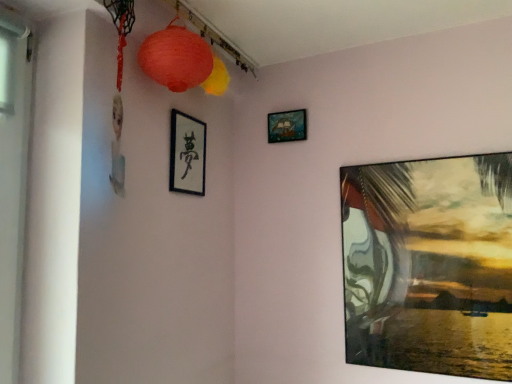
Where is `black matte picture frame at upper center, which ranks as the 2th picture frame in top-to-bottom order`? black matte picture frame at upper center, which ranks as the 2th picture frame in top-to-bottom order is located at coordinates coord(187,154).

What is the approximate width of matte paper lantern at upper center, positioned as the first lantern in front-to-back order?

matte paper lantern at upper center, positioned as the first lantern in front-to-back order, is 5.38 inches in width.

Measure the distance between point (222, 83) and camera.

Point (222, 83) is 5.52 feet from camera.

Where is `matte paper lantern at upper center, arranged as the 1th lantern when viewed from the back`? matte paper lantern at upper center, arranged as the 1th lantern when viewed from the back is located at coordinates (217, 78).

Where is `wooden ship at upper center, the 1th picture frame positioned from the top`? The image size is (512, 384). wooden ship at upper center, the 1th picture frame positioned from the top is located at coordinates (287, 126).

The image size is (512, 384). I want to click on lantern that appears in front of the matte glass painting at right, the first picture frame in the bottom-to-top sequence, so click(176, 58).

Does matte glass painting at right, which is the third picture frame in top-to-bottom order, have a smaller size compared to matte paper lantern at upper center, which is the 2th lantern in back-to-front order?

No.

Does point (462, 279) lie in front of point (153, 42)?

No.

From the image's perspective, which is below, matte glass painting at right, the first picture frame in the bottom-to-top sequence, or matte paper lantern at upper center, which is the 2th lantern in back-to-front order?

matte glass painting at right, the first picture frame in the bottom-to-top sequence, appears lower in the image.

Considering the positions of points (198, 45) and (283, 118), is point (198, 45) closer to camera compared to point (283, 118)?

Yes, point (198, 45) is closer to viewer.

How far apart are matte paper lantern at upper center, positioned as the first lantern in front-to-back order, and wooden ship at upper center, the 1th picture frame positioned from the top?

matte paper lantern at upper center, positioned as the first lantern in front-to-back order, and wooden ship at upper center, the 1th picture frame positioned from the top, are 25.85 inches apart from each other.

Who is smaller, matte paper lantern at upper center, positioned as the first lantern in front-to-back order, or wooden ship at upper center, acting as the 2th picture frame starting from the left?

wooden ship at upper center, acting as the 2th picture frame starting from the left.

Locate an element on the screen. Image resolution: width=512 pixels, height=384 pixels. the 1st picture frame positioned below the matte paper lantern at upper center, which is the 2th lantern in back-to-front order (from a real-world perspective) is located at coordinates (287, 126).

Which of these two, black matte picture frame at upper center, which appears as the 2th picture frame when ordered from the bottom, or matte paper lantern at upper center, positioned as the first lantern in front-to-back order, is smaller?

Smaller between the two is black matte picture frame at upper center, which appears as the 2th picture frame when ordered from the bottom.

Is point (184, 169) closer or farther from the camera than point (187, 51)?

Point (184, 169).

Between black matte picture frame at upper center, the first picture frame viewed from the left, and matte paper lantern at upper center, positioned as the first lantern in front-to-back order, which one has less height?

matte paper lantern at upper center, positioned as the first lantern in front-to-back order, is shorter.

In the scene shown: Is black matte picture frame at upper center, acting as the third picture frame starting from the right, aimed at matte paper lantern at upper center, positioned as the first lantern in front-to-back order?

No, black matte picture frame at upper center, acting as the third picture frame starting from the right, is not oriented towards matte paper lantern at upper center, positioned as the first lantern in front-to-back order.

In the image, is matte paper lantern at upper center, arranged as the 1th lantern when viewed from the back, positioned in front of or behind matte paper lantern at upper center, positioned as the first lantern in front-to-back order?

In the image, matte paper lantern at upper center, arranged as the 1th lantern when viewed from the back, appears behind matte paper lantern at upper center, positioned as the first lantern in front-to-back order.

Is matte paper lantern at upper center, the second lantern positioned from the front, directly adjacent to matte paper lantern at upper center, positioned as the first lantern in front-to-back order?

No.

Measure the distance from matte paper lantern at upper center, the second lantern positioned from the front, to matte paper lantern at upper center, which is the 2th lantern in back-to-front order.

The distance of matte paper lantern at upper center, the second lantern positioned from the front, from matte paper lantern at upper center, which is the 2th lantern in back-to-front order, is 6.45 inches.

Is matte paper lantern at upper center, arranged as the 1th lantern when viewed from the back, located outside matte paper lantern at upper center, which is the 2th lantern in back-to-front order?

matte paper lantern at upper center, arranged as the 1th lantern when viewed from the back, is positioned outside matte paper lantern at upper center, which is the 2th lantern in back-to-front order.

Is matte paper lantern at upper center, the second lantern positioned from the front, far from wooden ship at upper center, the second picture frame from the right?

No, matte paper lantern at upper center, the second lantern positioned from the front, is in close proximity to wooden ship at upper center, the second picture frame from the right.

Is point (228, 80) less distant than point (279, 112)?

No, (228, 80) is further to viewer.

Is matte paper lantern at upper center, the second lantern positioned from the front, turned away from wooden ship at upper center, acting as the 2th picture frame starting from the left?

matte paper lantern at upper center, the second lantern positioned from the front, is not turned away from wooden ship at upper center, acting as the 2th picture frame starting from the left.

Who is taller, matte paper lantern at upper center, arranged as the 1th lantern when viewed from the back, or wooden ship at upper center, acting as the 2th picture frame starting from the left?

matte paper lantern at upper center, arranged as the 1th lantern when viewed from the back, is taller.

From a real-world perspective, is matte glass painting at right, the first picture frame in the bottom-to-top sequence, physically located above or below wooden ship at upper center, the second picture frame from the right?

In terms of real-world spatial position, matte glass painting at right, the first picture frame in the bottom-to-top sequence, is below wooden ship at upper center, the second picture frame from the right.

Does matte glass painting at right, the first picture frame in the bottom-to-top sequence, touch wooden ship at upper center, acting as the 2th picture frame starting from the left?

No, matte glass painting at right, the first picture frame in the bottom-to-top sequence, is not with wooden ship at upper center, acting as the 2th picture frame starting from the left.

Relative to wooden ship at upper center, the 1th picture frame positioned from the top, is matte glass painting at right, which is the third picture frame in top-to-bottom order, in front or behind?

matte glass painting at right, which is the third picture frame in top-to-bottom order, is in front of wooden ship at upper center, the 1th picture frame positioned from the top.

From the image's perspective, which object appears higher, matte paper lantern at upper center, positioned as the first lantern in front-to-back order, or matte glass painting at right, the third picture frame in the left-to-right sequence?

matte paper lantern at upper center, positioned as the first lantern in front-to-back order, appears higher in the image.

In the image, is matte paper lantern at upper center, positioned as the first lantern in front-to-back order, positioned in front of or behind matte glass painting at right, which is the third picture frame in top-to-bottom order?

In the image, matte paper lantern at upper center, positioned as the first lantern in front-to-back order, appears in front of matte glass painting at right, which is the third picture frame in top-to-bottom order.

In terms of height, does matte paper lantern at upper center, positioned as the first lantern in front-to-back order, look taller or shorter compared to matte glass painting at right, the first picture frame in the bottom-to-top sequence?

In the image, matte paper lantern at upper center, positioned as the first lantern in front-to-back order, appears to be shorter than matte glass painting at right, the first picture frame in the bottom-to-top sequence.

The height and width of the screenshot is (384, 512). What are the coordinates of `lantern that is the 2nd one when counting leftward from the matte glass painting at right, arranged as the first picture frame when viewed from the right` in the screenshot? It's located at (176, 58).

Locate an element on the screen. The width and height of the screenshot is (512, 384). picture frame that is the 1st object directly below the matte paper lantern at upper center, which is the 2th lantern in back-to-front order (from a real-world perspective) is located at coordinates coord(287,126).

Based on their spatial positions, is matte glass painting at right, the first picture frame in the bottom-to-top sequence, or matte paper lantern at upper center, which is the 2th lantern in back-to-front order, further from black matte picture frame at upper center, which ranks as the 2th picture frame in top-to-bottom order?

Based on the image, matte glass painting at right, the first picture frame in the bottom-to-top sequence, appears to be further to black matte picture frame at upper center, which ranks as the 2th picture frame in top-to-bottom order.

Looking at the image, which one is located further to black matte picture frame at upper center, which appears as the 2th picture frame when ordered from the bottom, matte paper lantern at upper center, the second lantern positioned from the front, or matte paper lantern at upper center, positioned as the first lantern in front-to-back order?

matte paper lantern at upper center, positioned as the first lantern in front-to-back order, lies further to black matte picture frame at upper center, which appears as the 2th picture frame when ordered from the bottom, than the other object.

From the image, which object appears to be farther from black matte picture frame at upper center, which appears as the 2th picture frame when ordered from the bottom, wooden ship at upper center, the second picture frame from the right, or matte paper lantern at upper center, which is the 2th lantern in back-to-front order?

wooden ship at upper center, the second picture frame from the right, is further to black matte picture frame at upper center, which appears as the 2th picture frame when ordered from the bottom.

When comparing their distances from matte paper lantern at upper center, the second lantern positioned from the front, does matte glass painting at right, which is the third picture frame in top-to-bottom order, or matte paper lantern at upper center, which is the 2th lantern in back-to-front order, seem closer?

matte paper lantern at upper center, which is the 2th lantern in back-to-front order, is closer to matte paper lantern at upper center, the second lantern positioned from the front.

Based on their spatial positions, is matte paper lantern at upper center, positioned as the first lantern in front-to-back order, or black matte picture frame at upper center, the first picture frame viewed from the left, closer to matte paper lantern at upper center, arranged as the 1th lantern when viewed from the back?

The object closer to matte paper lantern at upper center, arranged as the 1th lantern when viewed from the back, is matte paper lantern at upper center, positioned as the first lantern in front-to-back order.

Estimate the real-world distances between objects in this image. Which object is closer to wooden ship at upper center, the 1th picture frame positioned from the top, matte paper lantern at upper center, the second lantern positioned from the front, or matte glass painting at right, arranged as the first picture frame when viewed from the right?

matte paper lantern at upper center, the second lantern positioned from the front.

Based on their spatial positions, is matte paper lantern at upper center, positioned as the first lantern in front-to-back order, or matte glass painting at right, arranged as the first picture frame when viewed from the right, further from matte paper lantern at upper center, the second lantern positioned from the front?

matte glass painting at right, arranged as the first picture frame when viewed from the right, is positioned further to the anchor matte paper lantern at upper center, the second lantern positioned from the front.

Based on their spatial positions, is matte paper lantern at upper center, positioned as the first lantern in front-to-back order, or matte paper lantern at upper center, the second lantern positioned from the front, further from wooden ship at upper center, the third picture frame positioned from the bottom?

Among the two, matte paper lantern at upper center, positioned as the first lantern in front-to-back order, is located further to wooden ship at upper center, the third picture frame positioned from the bottom.

The height and width of the screenshot is (384, 512). In order to click on picture frame between matte paper lantern at upper center, arranged as the 1th lantern when viewed from the back, and matte glass painting at right, the third picture frame in the left-to-right sequence, in the horizontal direction in this screenshot , I will do `click(287, 126)`.

Identify the location of picture frame between black matte picture frame at upper center, which appears as the 2th picture frame when ordered from the bottom, and matte glass painting at right, the first picture frame in the bottom-to-top sequence, in the horizontal direction. Image resolution: width=512 pixels, height=384 pixels. (287, 126).

Image resolution: width=512 pixels, height=384 pixels. What are the coordinates of `lantern between matte paper lantern at upper center, positioned as the first lantern in front-to-back order, and matte glass painting at right, the third picture frame in the left-to-right sequence, in the horizontal direction` in the screenshot? It's located at (217, 78).

Image resolution: width=512 pixels, height=384 pixels. I want to click on picture frame between matte paper lantern at upper center, positioned as the first lantern in front-to-back order, and matte glass painting at right, the third picture frame in the left-to-right sequence, from left to right, so click(x=287, y=126).